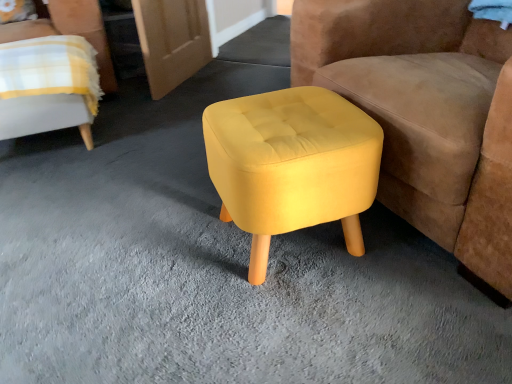
Where is `yellow fabric chair at upper left, marked as the second chair in a right-to-left arrangement`? The width and height of the screenshot is (512, 384). yellow fabric chair at upper left, marked as the second chair in a right-to-left arrangement is located at coordinates (53, 71).

Find the location of a particular element. yellow fabric chair at upper left, marked as the second chair in a right-to-left arrangement is located at coordinates (x=53, y=71).

Is yellow fabric chair at upper left, marked as the second chair in a right-to-left arrangement, with yellow fabric ottoman at center, arranged as the second chair when viewed from the left?

No, yellow fabric chair at upper left, marked as the second chair in a right-to-left arrangement, is not in contact with yellow fabric ottoman at center, arranged as the second chair when viewed from the left.

From the image's perspective, which object appears higher, yellow fabric chair at upper left, which is counted as the 1th chair, starting from the left, or yellow fabric ottoman at center, arranged as the first chair when viewed from the right?

yellow fabric chair at upper left, which is counted as the 1th chair, starting from the left.

How much distance is there between yellow fabric chair at upper left, which is counted as the 1th chair, starting from the left, and yellow fabric ottoman at center, arranged as the first chair when viewed from the right?

yellow fabric chair at upper left, which is counted as the 1th chair, starting from the left, and yellow fabric ottoman at center, arranged as the first chair when viewed from the right, are 1.16 meters apart.

From the image's perspective, does yellow fabric ottoman at center appear lower than yellow fabric chair at upper left, marked as the second chair in a right-to-left arrangement?

No, from the image's perspective, yellow fabric ottoman at center is not below yellow fabric chair at upper left, marked as the second chair in a right-to-left arrangement.

Is the depth of yellow fabric ottoman at center greater than that of yellow fabric chair at upper left, which is counted as the 1th chair, starting from the left?

That is True.

Would you say yellow fabric ottoman at center is outside yellow fabric chair at upper left, which is counted as the 1th chair, starting from the left?

Indeed, yellow fabric ottoman at center is completely outside yellow fabric chair at upper left, which is counted as the 1th chair, starting from the left.

Does yellow fabric chair at upper left, marked as the second chair in a right-to-left arrangement, appear on the right side of yellow fabric stool at center?

No, yellow fabric chair at upper left, marked as the second chair in a right-to-left arrangement, is not to the right of yellow fabric stool at center.

Is yellow fabric chair at upper left, which is counted as the 1th chair, starting from the left, far from yellow fabric stool at center?

They are positioned close to each other.

Is yellow fabric stool at center facing towards yellow fabric ottoman at center?

No, yellow fabric stool at center is not turned towards yellow fabric ottoman at center.

Which is in front, point (292, 201) or point (286, 64)?

The point (292, 201) is in front.

From a real-world perspective, which object rests below the other?

In real-world perspective, yellow fabric ottoman at center is lower.

From the image's perspective, is yellow fabric stool at center beneath yellow fabric ottoman at center?

Yes, from the image's perspective, yellow fabric stool at center is below yellow fabric ottoman at center.

Which of these two, yellow fabric ottoman at center, arranged as the first chair when viewed from the right, or yellow fabric chair at upper left, which is counted as the 1th chair, starting from the left, is thinner?

yellow fabric chair at upper left, which is counted as the 1th chair, starting from the left.

Is yellow fabric ottoman at center, arranged as the first chair when viewed from the right, not near yellow fabric chair at upper left, marked as the second chair in a right-to-left arrangement?

Yes.

From a real-world perspective, which is physically above, yellow fabric ottoman at center, arranged as the first chair when viewed from the right, or yellow fabric chair at upper left, which is counted as the 1th chair, starting from the left?

yellow fabric ottoman at center, arranged as the first chair when viewed from the right, is physically above.

Is point (484, 207) farther from camera compared to point (5, 47)?

That is False.

Based on their positions, is yellow fabric stool at center located to the left or right of yellow fabric ottoman at center, arranged as the first chair when viewed from the right?

Clearly, yellow fabric stool at center is on the left of yellow fabric ottoman at center, arranged as the first chair when viewed from the right, in the image.

Does point (253, 161) come behind point (469, 150)?

That is False.

Is yellow fabric stool at center positioned far away from yellow fabric ottoman at center, arranged as the second chair when viewed from the left?

No, yellow fabric stool at center is in close proximity to yellow fabric ottoman at center, arranged as the second chair when viewed from the left.

Is yellow fabric ottoman at center, arranged as the second chair when viewed from the left, inside yellow fabric stool at center?

That's incorrect, yellow fabric ottoman at center, arranged as the second chair when viewed from the left, is not inside yellow fabric stool at center.

Is yellow fabric ottoman at center positioned beyond the bounds of yellow fabric ottoman at center, arranged as the first chair when viewed from the right?

Yes, yellow fabric ottoman at center is located beyond the bounds of yellow fabric ottoman at center, arranged as the first chair when viewed from the right.

Can you confirm if yellow fabric ottoman at center is taller than yellow fabric ottoman at center, arranged as the first chair when viewed from the right?

No.

Find the location of `the 2nd chair in front of the yellow fabric ottoman at center`. the 2nd chair in front of the yellow fabric ottoman at center is located at coordinates (426, 113).

Is yellow fabric ottoman at center in contact with yellow fabric ottoman at center, arranged as the second chair when viewed from the left?

No.

This screenshot has width=512, height=384. In order to click on chair below the yellow fabric ottoman at center, arranged as the second chair when viewed from the left (from a real-world perspective) in this screenshot , I will do `click(53, 71)`.

In order to click on chair on the left of yellow fabric ottoman at center in this screenshot , I will do `click(53, 71)`.

When comparing their distances from yellow fabric ottoman at center, does yellow fabric chair at upper left, marked as the second chair in a right-to-left arrangement, or yellow fabric stool at center seem further?

Based on the image, yellow fabric stool at center appears to be further to yellow fabric ottoman at center.

Considering their positions, is yellow fabric ottoman at center positioned closer to yellow fabric chair at upper left, marked as the second chair in a right-to-left arrangement, than yellow fabric ottoman at center, arranged as the first chair when viewed from the right?

The object closer to yellow fabric chair at upper left, marked as the second chair in a right-to-left arrangement, is yellow fabric ottoman at center, arranged as the first chair when viewed from the right.

Which object lies further to the anchor point yellow fabric ottoman at center, yellow fabric stool at center or yellow fabric ottoman at center, arranged as the first chair when viewed from the right?

The object further to yellow fabric ottoman at center is yellow fabric stool at center.

From the image, which object appears to be nearer to yellow fabric ottoman at center, yellow fabric stool at center or yellow fabric chair at upper left, which is counted as the 1th chair, starting from the left?

yellow fabric chair at upper left, which is counted as the 1th chair, starting from the left, is closer to yellow fabric ottoman at center.

From the image, which object appears to be nearer to yellow fabric ottoman at center, arranged as the first chair when viewed from the right, yellow fabric chair at upper left, which is counted as the 1th chair, starting from the left, or yellow fabric stool at center?

yellow fabric stool at center is positioned closer to the anchor yellow fabric ottoman at center, arranged as the first chair when viewed from the right.

Considering their positions, is yellow fabric ottoman at center, arranged as the first chair when viewed from the right, positioned closer to yellow fabric stool at center than yellow fabric chair at upper left, which is counted as the 1th chair, starting from the left?

The object closer to yellow fabric stool at center is yellow fabric ottoman at center, arranged as the first chair when viewed from the right.

Estimate the real-world distances between objects in this image. Which object is closer to yellow fabric ottoman at center, yellow fabric ottoman at center, arranged as the second chair when viewed from the left, or yellow fabric chair at upper left, marked as the second chair in a right-to-left arrangement?

The object closer to yellow fabric ottoman at center is yellow fabric chair at upper left, marked as the second chair in a right-to-left arrangement.

Based on their spatial positions, is yellow fabric stool at center or yellow fabric ottoman at center closer to yellow fabric chair at upper left, which is counted as the 1th chair, starting from the left?

yellow fabric stool at center.

Where is `chair between yellow fabric stool at center and yellow fabric ottoman at center along the z-axis`? This screenshot has height=384, width=512. chair between yellow fabric stool at center and yellow fabric ottoman at center along the z-axis is located at coordinates tap(53, 71).

Where is `stool between yellow fabric chair at upper left, which is counted as the 1th chair, starting from the left, and yellow fabric ottoman at center, arranged as the first chair when viewed from the right, in the horizontal direction`? The width and height of the screenshot is (512, 384). stool between yellow fabric chair at upper left, which is counted as the 1th chair, starting from the left, and yellow fabric ottoman at center, arranged as the first chair when viewed from the right, in the horizontal direction is located at coordinates (292, 165).

Locate an element on the screen. Image resolution: width=512 pixels, height=384 pixels. chair between yellow fabric ottoman at center, arranged as the second chair when viewed from the left, and yellow fabric ottoman at center from front to back is located at coordinates (53, 71).

Where is `stool positioned between yellow fabric ottoman at center, arranged as the second chair when viewed from the left, and yellow fabric ottoman at center from near to far`? Image resolution: width=512 pixels, height=384 pixels. stool positioned between yellow fabric ottoman at center, arranged as the second chair when viewed from the left, and yellow fabric ottoman at center from near to far is located at coordinates (292, 165).